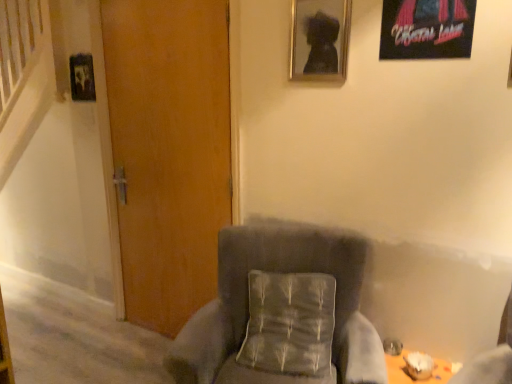
The width and height of the screenshot is (512, 384). What do you see at coordinates (289, 324) in the screenshot?
I see `textured gray pillow at center` at bounding box center [289, 324].

What do you see at coordinates (82, 78) in the screenshot? The image size is (512, 384). I see `metallic silver picture frame at upper left, the 1th picture frame in the left-to-right sequence` at bounding box center [82, 78].

I want to click on metallic silver picture frame at upper left, the 1th picture frame in the left-to-right sequence, so click(x=82, y=78).

The height and width of the screenshot is (384, 512). What do you see at coordinates (282, 313) in the screenshot?
I see `velvet gray armchair at center` at bounding box center [282, 313].

The height and width of the screenshot is (384, 512). I want to click on metallic poster at upper right, the third picture frame viewed from the back, so click(x=426, y=29).

Can you confirm if metallic poster at upper right, the third picture frame viewed from the back, is smaller than metallic silver picture frame at upper left, the third picture frame from the front?

No.

Can you confirm if metallic poster at upper right, the first picture frame positioned from the right, is positioned to the left of metallic silver picture frame at upper left, which is the first picture frame in back-to-front order?

In fact, metallic poster at upper right, the first picture frame positioned from the right, is to the right of metallic silver picture frame at upper left, which is the first picture frame in back-to-front order.

At what (x,y) coordinates should I click in order to perform the action: click on picture frame above the metallic silver picture frame at upper left, marked as the third picture frame in a right-to-left arrangement (from the image's perspective). Please return your answer as a coordinate pair (x, y). Looking at the image, I should click on (426, 29).

Is metallic poster at upper right, the first picture frame positioned from the right, facing towards metallic silver picture frame at upper left, which is the first picture frame in back-to-front order?

No, metallic poster at upper right, the first picture frame positioned from the right, is not facing towards metallic silver picture frame at upper left, which is the first picture frame in back-to-front order.

Considering the relative sizes of metallic silver picture frame at upper left, which is the first picture frame in back-to-front order, and metallic poster at upper right, the third picture frame viewed from the back, in the image provided, is metallic silver picture frame at upper left, which is the first picture frame in back-to-front order, taller than metallic poster at upper right, the third picture frame viewed from the back,?

No.

Which object is positioned more to the left, metallic silver picture frame at upper left, which is the first picture frame in back-to-front order, or metallic poster at upper right, arranged as the 3th picture frame when viewed from the left?

metallic silver picture frame at upper left, which is the first picture frame in back-to-front order.

Is metallic silver picture frame at upper left, the third picture frame from the front, touching metallic poster at upper right, arranged as the 3th picture frame when viewed from the left?

metallic silver picture frame at upper left, the third picture frame from the front, and metallic poster at upper right, arranged as the 3th picture frame when viewed from the left, are clearly separated.

In the scene shown: Measure the distance from metallic poster at upper right, the third picture frame viewed from the back, to matte black picture frame at upper center, marked as the second picture frame in a left-to-right arrangement.

metallic poster at upper right, the third picture frame viewed from the back, is 10.75 inches away from matte black picture frame at upper center, marked as the second picture frame in a left-to-right arrangement.

At what (x,y) coordinates should I click in order to perform the action: click on the 1st picture frame directly beneath the metallic poster at upper right, the first picture frame positioned from the right (from a real-world perspective). Please return your answer as a coordinate pair (x, y). The image size is (512, 384). Looking at the image, I should click on (319, 40).

From a real-world perspective, is metallic poster at upper right, acting as the first picture frame starting from the front, physically located above or below matte black picture frame at upper center, which is the second picture frame from right to left?

metallic poster at upper right, acting as the first picture frame starting from the front, is situated higher than matte black picture frame at upper center, which is the second picture frame from right to left, in the real world.

From the picture: Which object is closer to the camera, metallic poster at upper right, the third picture frame viewed from the back, or matte black picture frame at upper center, which ranks as the 2th picture frame in back-to-front order?

metallic poster at upper right, the third picture frame viewed from the back, is closer to the camera.

Is wooden door at center spatially inside matte black picture frame at upper center, which ranks as the 2th picture frame in back-to-front order, or outside of it?

wooden door at center is outside matte black picture frame at upper center, which ranks as the 2th picture frame in back-to-front order.

From a real-world perspective, is wooden door at center positioned over matte black picture frame at upper center, which is the second picture frame from front to back, based on gravity?

Actually, wooden door at center is physically below matte black picture frame at upper center, which is the second picture frame from front to back, in the real world.

Would you say wooden door at center is to the left or to the right of matte black picture frame at upper center, which is the second picture frame from front to back, in the picture?

wooden door at center is positioned on matte black picture frame at upper center, which is the second picture frame from front to back,'s left side.

From the image's perspective, is wooden door at center located above or below matte black picture frame at upper center, marked as the second picture frame in a left-to-right arrangement?

wooden door at center is below matte black picture frame at upper center, marked as the second picture frame in a left-to-right arrangement.

In the scene shown: Between textured gray pillow at center and velvet gray armchair at center, which one is positioned in front?

velvet gray armchair at center.

How distant is textured gray pillow at center from velvet gray armchair at center?

textured gray pillow at center and velvet gray armchair at center are 2.44 inches apart.

Are textured gray pillow at center and velvet gray armchair at center making contact?

Yes, the surface of textured gray pillow at center is in contact with velvet gray armchair at center.

Does point (263, 369) come behind point (316, 229)?

No, it is in front of (316, 229).

Which object is closer to the camera, textured gray pillow at center or matte black picture frame at upper center, marked as the second picture frame in a left-to-right arrangement?

textured gray pillow at center is more forward.

Is textured gray pillow at center wider or thinner than matte black picture frame at upper center, marked as the second picture frame in a left-to-right arrangement?

textured gray pillow at center is wider than matte black picture frame at upper center, marked as the second picture frame in a left-to-right arrangement.

Does point (311, 375) lie behind point (293, 43)?

No, it is in front of (293, 43).

Image resolution: width=512 pixels, height=384 pixels. What are the coordinates of `pillow in front of the matte black picture frame at upper center, marked as the second picture frame in a left-to-right arrangement` in the screenshot? It's located at (289, 324).

From a real-world perspective, is matte black picture frame at upper center, marked as the second picture frame in a left-to-right arrangement, physically above wooden door at center?

Yes, from a real-world perspective, matte black picture frame at upper center, marked as the second picture frame in a left-to-right arrangement, is above wooden door at center.

Can you confirm if matte black picture frame at upper center, which ranks as the 2th picture frame in back-to-front order, is positioned to the right of wooden door at center?

Yes, matte black picture frame at upper center, which ranks as the 2th picture frame in back-to-front order, is to the right of wooden door at center.

Is matte black picture frame at upper center, which is the second picture frame from right to left, located outside wooden door at center?

Yes.

Can you tell me how much matte black picture frame at upper center, marked as the second picture frame in a left-to-right arrangement, and wooden door at center differ in facing direction?

The angular difference between matte black picture frame at upper center, marked as the second picture frame in a left-to-right arrangement, and wooden door at center is 0.000556 degrees.

This screenshot has height=384, width=512. Identify the location of picture frame that appears above the metallic silver picture frame at upper left, marked as the third picture frame in a right-to-left arrangement (from the image's perspective). (426, 29).

Where is `the 2nd picture frame to the left when counting from the metallic poster at upper right, arranged as the 3th picture frame when viewed from the left`? the 2nd picture frame to the left when counting from the metallic poster at upper right, arranged as the 3th picture frame when viewed from the left is located at coordinates (82, 78).

In the scene shown: From the image, which object appears to be farther from metallic silver picture frame at upper left, the 1th picture frame in the left-to-right sequence, textured gray pillow at center or wooden door at center?

textured gray pillow at center lies further to metallic silver picture frame at upper left, the 1th picture frame in the left-to-right sequence, than the other object.

Based on their spatial positions, is textured gray pillow at center or metallic poster at upper right, acting as the first picture frame starting from the front, closer to metallic silver picture frame at upper left, the third picture frame from the front?

textured gray pillow at center is positioned closer to the anchor metallic silver picture frame at upper left, the third picture frame from the front.

When comparing their distances from wooden door at center, does textured gray pillow at center or velvet gray armchair at center seem closer?

velvet gray armchair at center is closer to wooden door at center.

Which object lies nearer to the anchor point velvet gray armchair at center, wooden door at center or matte black picture frame at upper center, which is the second picture frame from right to left?

wooden door at center is closer to velvet gray armchair at center.

Estimate the real-world distances between objects in this image. Which object is further from metallic silver picture frame at upper left, which is the first picture frame in back-to-front order, matte black picture frame at upper center, which ranks as the 2th picture frame in back-to-front order, or metallic poster at upper right, the third picture frame viewed from the back?

metallic poster at upper right, the third picture frame viewed from the back.

Looking at the image, which one is located closer to metallic poster at upper right, arranged as the 3th picture frame when viewed from the left, velvet gray armchair at center or textured gray pillow at center?

velvet gray armchair at center lies closer to metallic poster at upper right, arranged as the 3th picture frame when viewed from the left, than the other object.

Considering their positions, is metallic poster at upper right, the first picture frame positioned from the right, positioned closer to velvet gray armchair at center than wooden door at center?

The object closer to velvet gray armchair at center is wooden door at center.

Which object lies further to the anchor point metallic poster at upper right, the third picture frame viewed from the back, velvet gray armchair at center or wooden door at center?

wooden door at center.

This screenshot has width=512, height=384. I want to click on door located between metallic silver picture frame at upper left, which is the first picture frame in back-to-front order, and matte black picture frame at upper center, which is the second picture frame from right to left, in the left-right direction, so click(x=169, y=151).

The image size is (512, 384). In order to click on chair between metallic silver picture frame at upper left, the 1th picture frame in the left-to-right sequence, and metallic poster at upper right, acting as the first picture frame starting from the front, in the horizontal direction in this screenshot , I will do `click(282, 313)`.

Where is `door between matte black picture frame at upper center, which ranks as the 2th picture frame in back-to-front order, and velvet gray armchair at center in the up-down direction`? The height and width of the screenshot is (384, 512). door between matte black picture frame at upper center, which ranks as the 2th picture frame in back-to-front order, and velvet gray armchair at center in the up-down direction is located at coordinates (169, 151).

Find the location of a particular element. The height and width of the screenshot is (384, 512). pillow between matte black picture frame at upper center, which is the second picture frame from right to left, and velvet gray armchair at center from top to bottom is located at coordinates (289, 324).